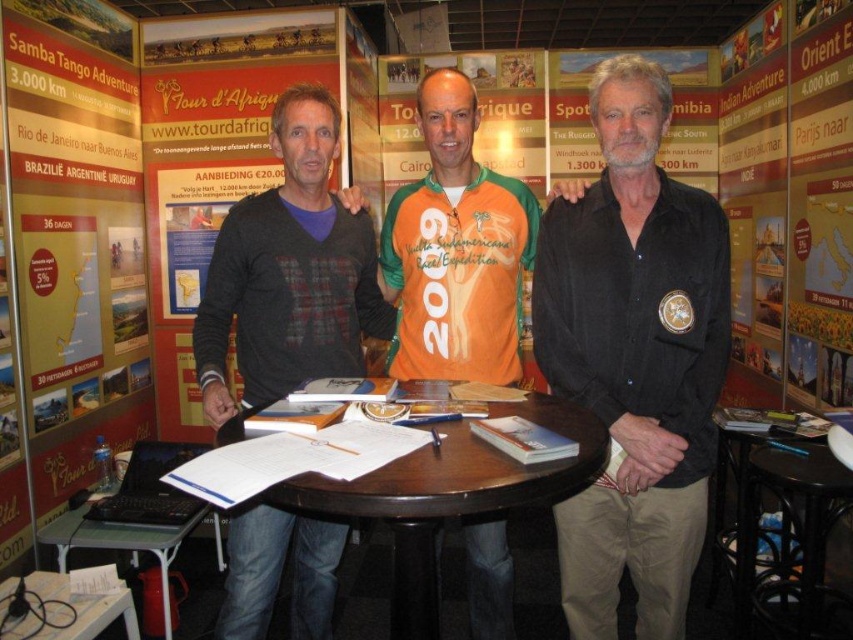
You are a visitor at the travel exhibition and want to ask questions to the men behind the round table. Which object, the black matte shirt at center or the dark brown wood round table at center, is taller?

The black matte shirt at center is taller than the dark brown wood round table at center according to the description.

From the picture: You are standing at the origin point of the coordinate system. Which direction should you move to reach the black matte shirt at center?

The black matte shirt at center is located at coordinate point 0.559 on the x axis and 0.744 on the y axis, so you should move to the right and forward to reach it.